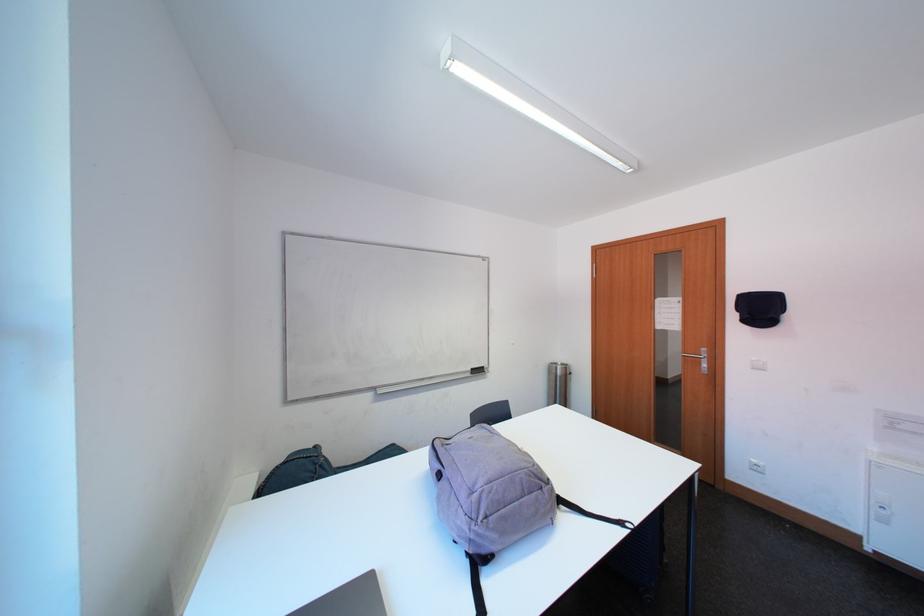
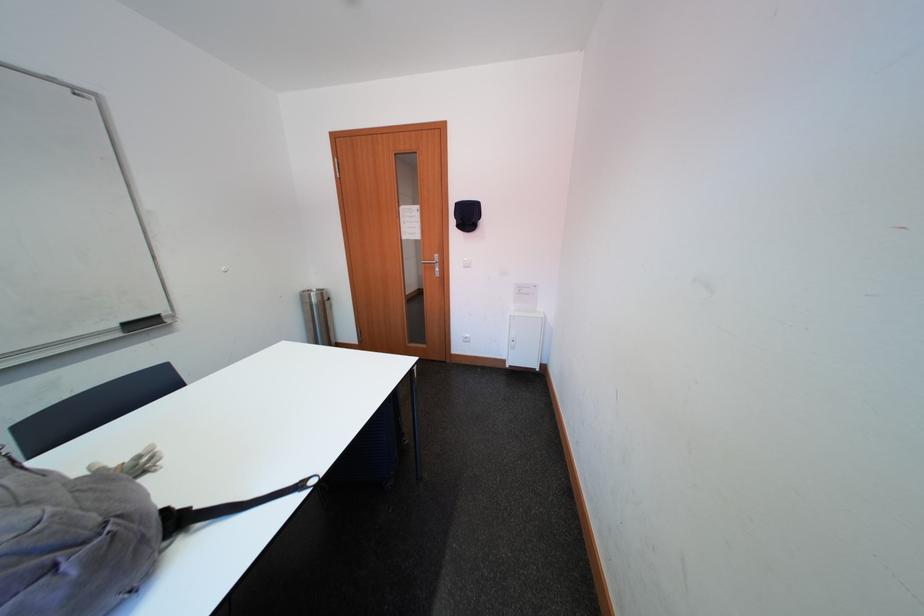
Based on the continuous images, in which direction is the camera rotating?

The camera rotated toward right-down.